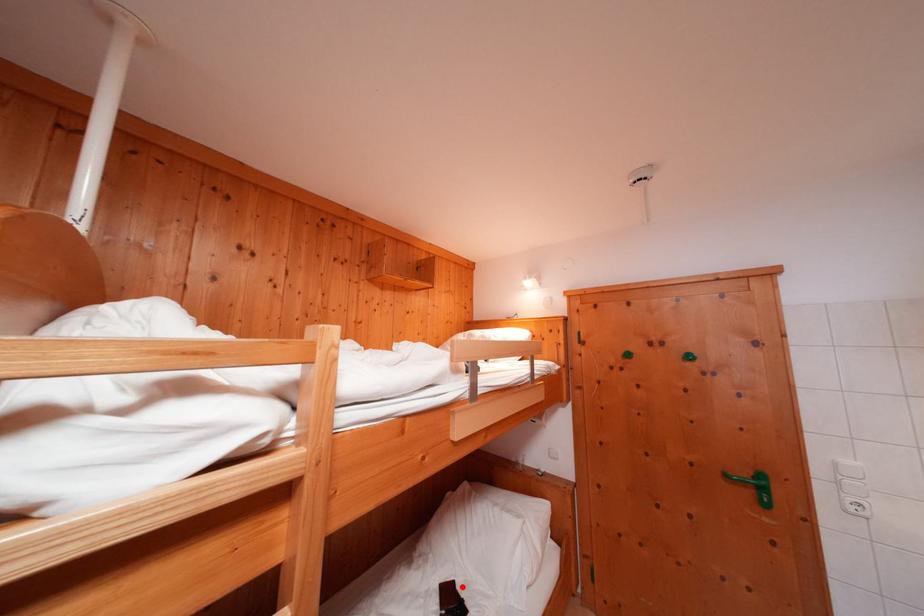
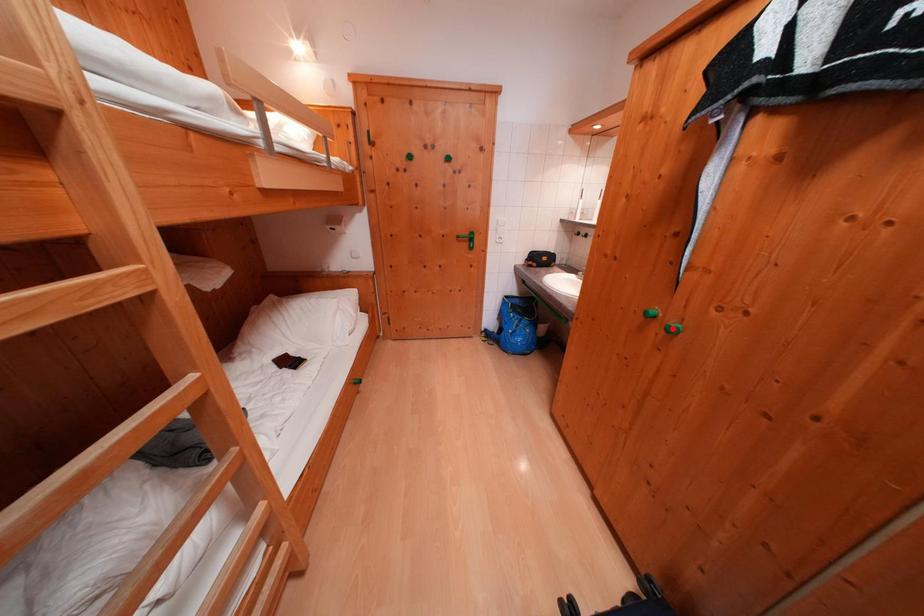
I am providing you with two images of the same scene from different viewpoints. A red point is marked on the first image and another point is marked on the second image. Do the highlighted points in image1 and image2 indicate the same real-world spot?

No